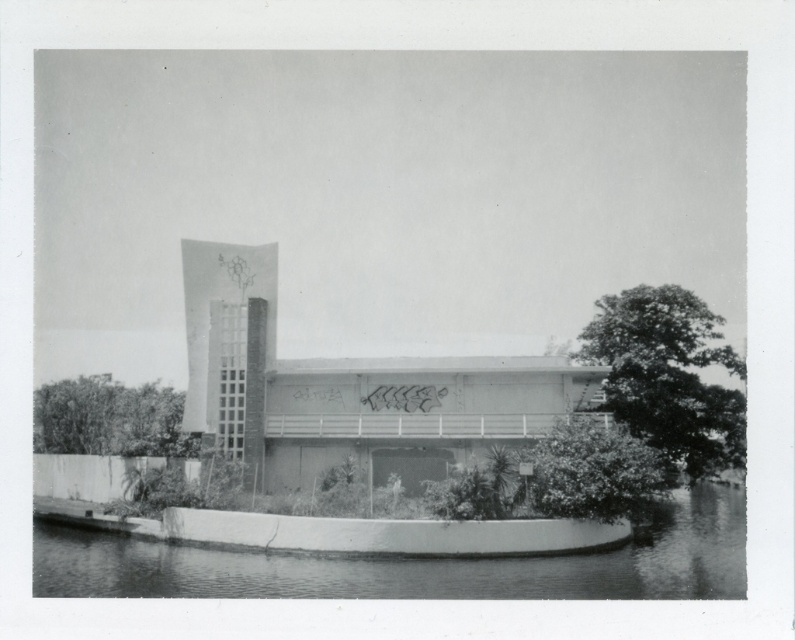
From the picture: Does smooth concrete river at lower center have a smaller size compared to dark green leafy tree at right?

Yes.

Is the position of smooth concrete river at lower center more distant than that of dark green leafy tree at right?

No, smooth concrete river at lower center is in front of dark green leafy tree at right.

Where is `smooth concrete river at lower center`? Image resolution: width=795 pixels, height=640 pixels. smooth concrete river at lower center is located at coordinates (x=413, y=564).

Is smooth concrete river at lower center positioned before green leafy tree at lower left?

That is True.

This screenshot has height=640, width=795. What are the coordinates of `smooth concrete river at lower center` in the screenshot? It's located at (413, 564).

This screenshot has width=795, height=640. I want to click on smooth concrete river at lower center, so click(413, 564).

Does dark green leafy tree at right appear on the left side of green leafy tree at lower left?

Incorrect, dark green leafy tree at right is not on the left side of green leafy tree at lower left.

Between point (636, 372) and point (169, 422), which one is positioned in front?

Point (636, 372) is more forward.

Where is `dark green leafy tree at right`? The width and height of the screenshot is (795, 640). dark green leafy tree at right is located at coordinates (669, 376).